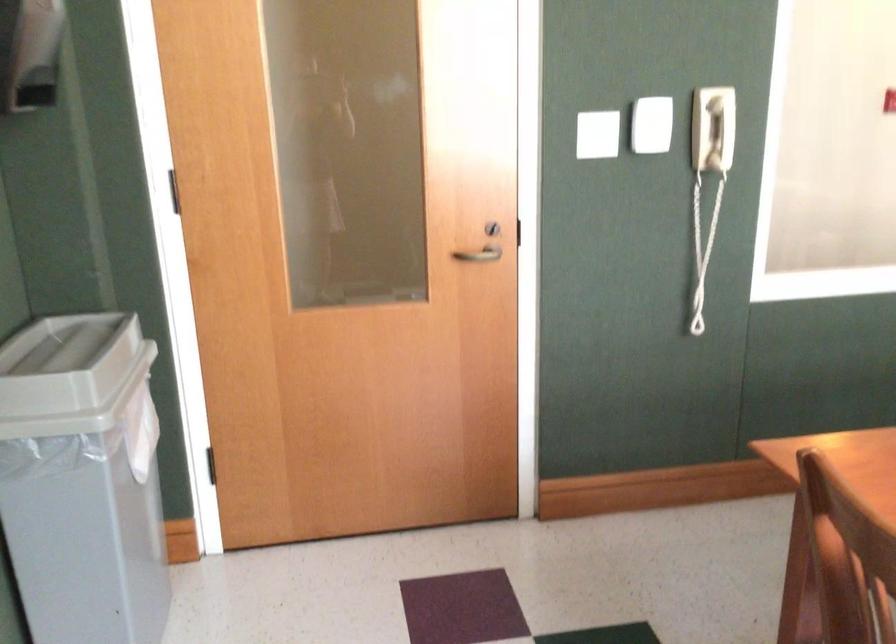
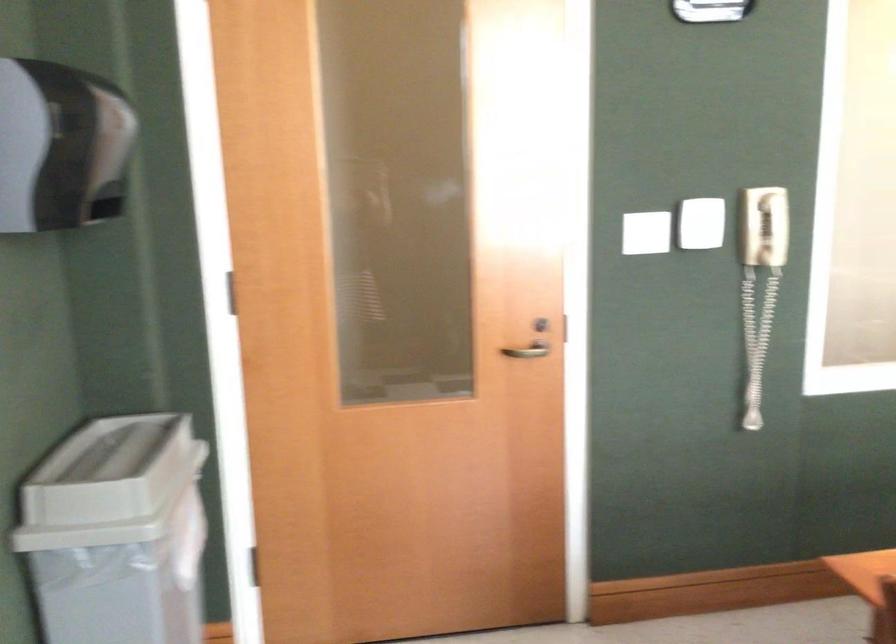
Question: How did the camera likely rotate?

Choices:
 (A) Left
 (B) Right
 (C) Up
 (D) Down

Answer: (C)